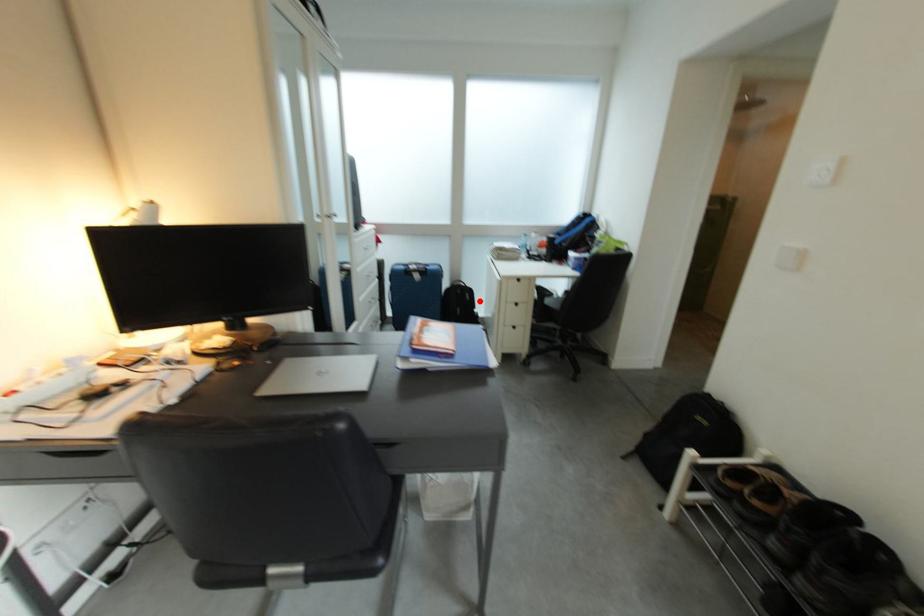
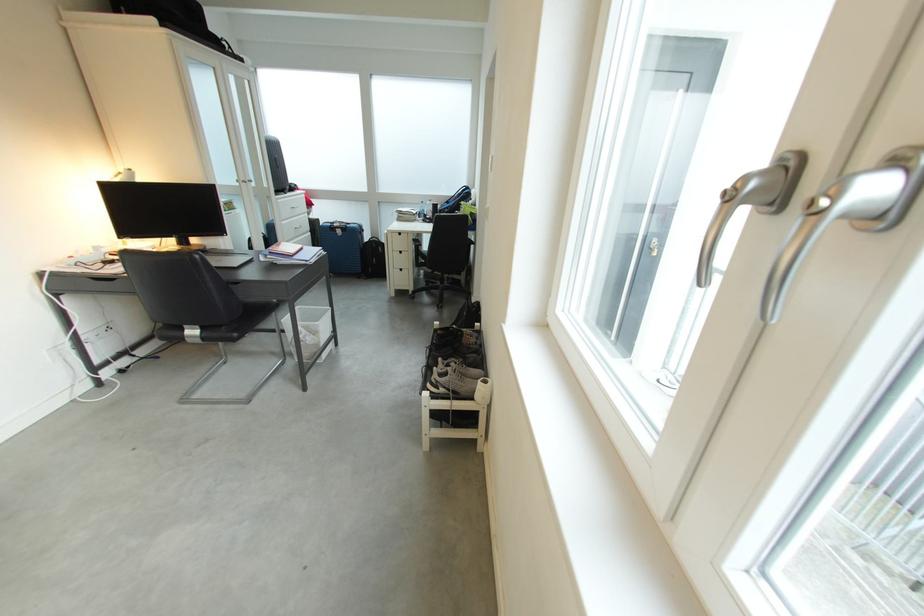
Question: I am providing you with two images of the same scene from different viewpoints. A red point is shown in image1. For the corresponding object point in image2, is it positioned nearer or farther from the camera?

Choices:
 (A) Nearer
 (B) Farther

Answer: (B)